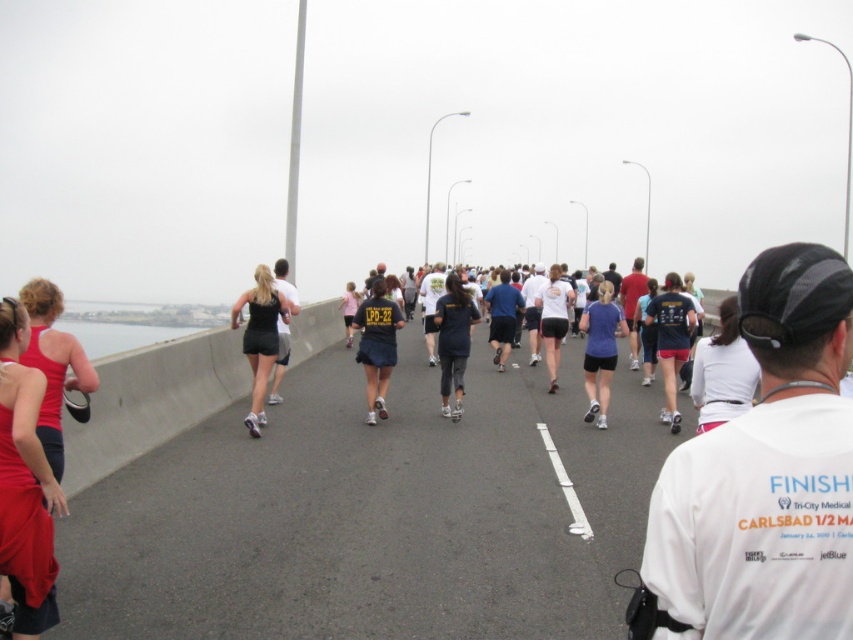
You are a photographer positioned at the finish line of the marathon. You want to capture a photo of the dark blue skirt at center and dark blue jersey at center such that both are clearly visible. Based on their widths, which one should you focus on to ensure it doesn not get cropped out of the frame?

The dark blue skirt at center is wider than the dark blue jersey at center, so you should focus on the dark blue skirt at center to ensure it does not get cropped out of the frame.

You are a photographer positioned at the starting line of the marathon, and you want to capture a photo of the dark blue skirt at center and the dark blue jersey at center. Which one should you focus on first to ensure it is in the foreground?

The dark blue skirt at center is not as tall as the dark blue jersey at center, so you should focus on the dark blue jersey at center first to ensure it is in the foreground.